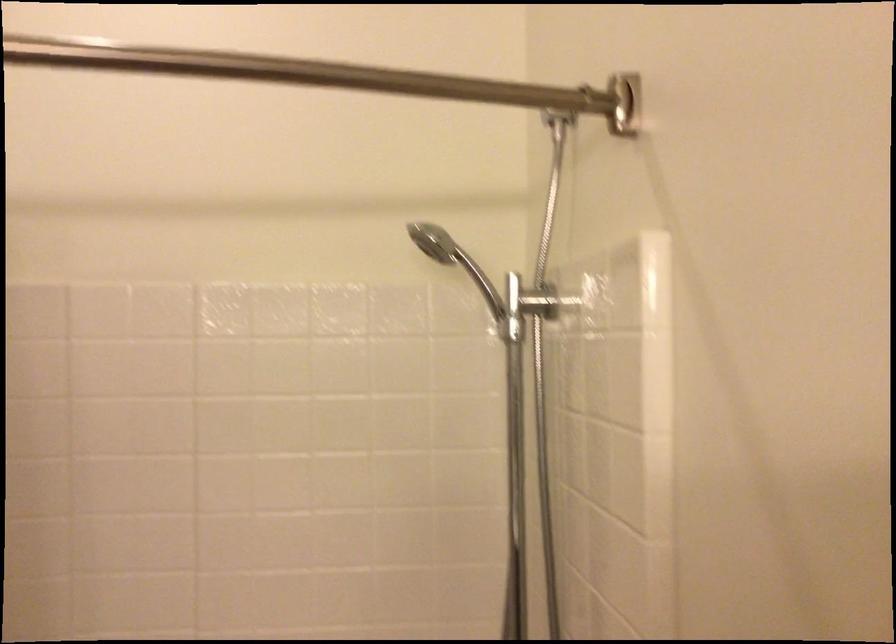
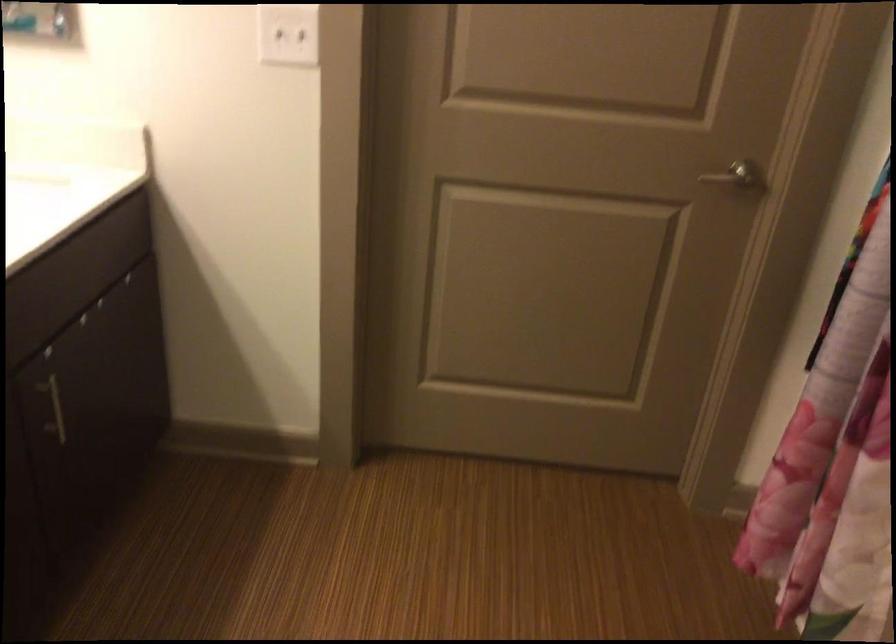
How did the camera likely rotate?

The camera rotated toward left-down.